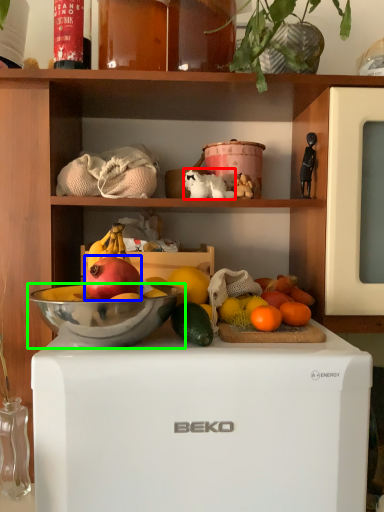
Question: Which object is positioned farthest from animal (highlighted by a red box)? Select from grapefruit (highlighted by a blue box) and bowl (highlighted by a green box).

Choices:
 (A) grapefruit
 (B) bowl

Answer: (B)